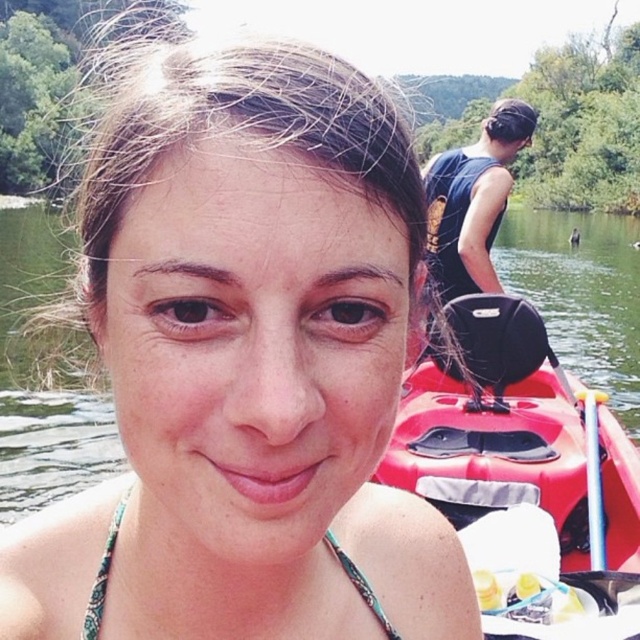
You are a photographer trying to capture the matte black swimsuit at center and the silver metallic paddle at upper right in the same frame. Based on their positions, which object is closer to the left side of the photo?

The matte black swimsuit at center is closer to the left side of the photo because it is positioned to the left of the silver metallic paddle at upper right.

What is the location of the green printed bikini top at center in the image?

The green printed bikini top at center is located at point (102, 577).

You are a photographer trying to capture the matte black swimsuit at center and the silver metallic paddle at upper right in a single frame. Based on their positions, will the swimsuit appear higher up in the photo compared to the paddle?

Yes, the matte black swimsuit at center is above the silver metallic paddle at upper right, so it will appear higher in the photo.